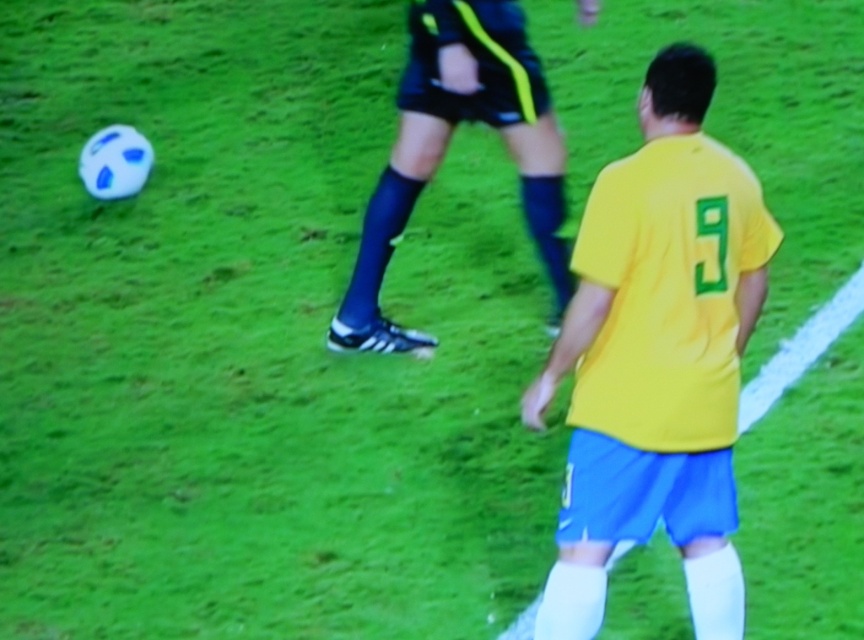
You are a soccer referee positioned at the edge of the field. You need to determine if the two players are within the required 5 feet distance for a legal play. Are the yellow matte jersey at center and black synthetic shorts at center within the 5 feet distance requirement?

The yellow matte jersey at center and black synthetic shorts at center are 5.48 feet apart from each other. Since 5.48 feet is greater than the required 5 feet, the players are slightly outside the legal distance for the play.

In the scene shown: You are a photographer trying to capture the soccer player in the center. Which object, the yellow matte jersey at center or the black synthetic shorts at center, should you zoom in on if you want to focus on the smaller item?

The yellow matte jersey at center is smaller than the black synthetic shorts at center, so you should zoom in on the yellow matte jersey at center to focus on the smaller item.

You are a soccer referee observing the match. You notice the yellow matte jersey at center and the black synthetic shorts at center. Which item is located lower in the image?

The yellow matte jersey at center is positioned under the black synthetic shorts at center, so it is located lower in the image.